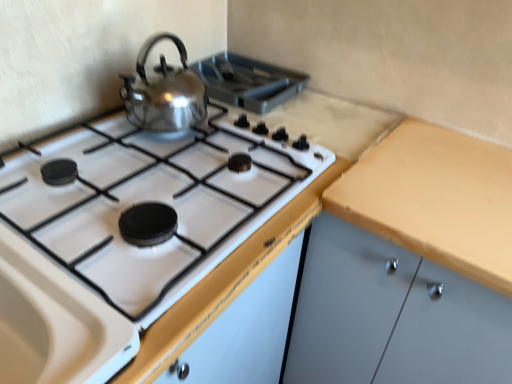
Question: Can you confirm if matte wood cabinet at right is thinner than shiny metallic kettle at upper left?

Choices:
 (A) no
 (B) yes

Answer: (A)

Question: From the image's perspective, is matte wood cabinet at right beneath shiny metallic kettle at upper left?

Choices:
 (A) no
 (B) yes

Answer: (B)

Question: Would you say matte wood cabinet at right contains shiny metallic kettle at upper left?

Choices:
 (A) yes
 (B) no

Answer: (B)

Question: Does matte wood cabinet at right have a lesser height compared to shiny metallic kettle at upper left?

Choices:
 (A) yes
 (B) no

Answer: (B)

Question: Is matte wood cabinet at right positioned with its back to shiny metallic kettle at upper left?

Choices:
 (A) yes
 (B) no

Answer: (B)

Question: Is matte wood cabinet at right oriented towards shiny metallic kettle at upper left?

Choices:
 (A) yes
 (B) no

Answer: (B)

Question: Does polished stainless steel kettle at upper center appear on the right side of matte wood cabinet at right?

Choices:
 (A) no
 (B) yes

Answer: (A)

Question: Considering the relative sizes of polished stainless steel kettle at upper center and matte wood cabinet at right in the image provided, is polished stainless steel kettle at upper center smaller than matte wood cabinet at right?

Choices:
 (A) no
 (B) yes

Answer: (B)

Question: Does polished stainless steel kettle at upper center contain matte wood cabinet at right?

Choices:
 (A) yes
 (B) no

Answer: (B)

Question: From a real-world perspective, is polished stainless steel kettle at upper center located beneath matte wood cabinet at right?

Choices:
 (A) no
 (B) yes

Answer: (A)

Question: Is polished stainless steel kettle at upper center positioned behind matte wood cabinet at right?

Choices:
 (A) yes
 (B) no

Answer: (A)

Question: Considering the relative sizes of polished stainless steel kettle at upper center and matte wood cabinet at right in the image provided, is polished stainless steel kettle at upper center wider than matte wood cabinet at right?

Choices:
 (A) no
 (B) yes

Answer: (A)

Question: Is shiny metallic kettle at upper left closer to camera compared to matte wood cabinet at right?

Choices:
 (A) yes
 (B) no

Answer: (B)